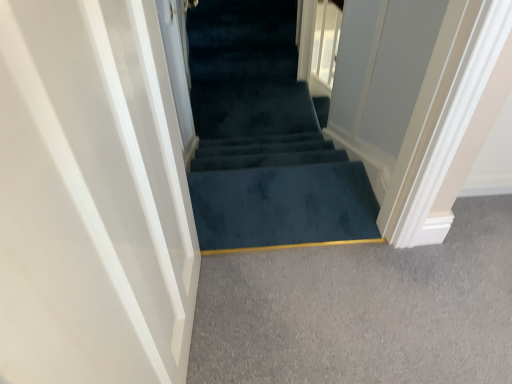
Question: Is white glossy door at left wider than teal carpeted stairs at center?

Choices:
 (A) no
 (B) yes

Answer: (B)

Question: Is white glossy door at left taller than teal carpeted stairs at center?

Choices:
 (A) no
 (B) yes

Answer: (B)

Question: Does white glossy door at left have a larger size compared to teal carpeted stairs at center?

Choices:
 (A) yes
 (B) no

Answer: (A)

Question: Does white glossy door at left come behind teal carpeted stairs at center?

Choices:
 (A) no
 (B) yes

Answer: (A)

Question: Is white glossy door at left not near teal carpeted stairs at center?

Choices:
 (A) no
 (B) yes

Answer: (B)

Question: Is white glossy door at left positioned with its back to teal carpeted stairs at center?

Choices:
 (A) no
 (B) yes

Answer: (A)

Question: From the image's perspective, would you say teal carpeted stairs at center is shown under white glossy door at left?

Choices:
 (A) yes
 (B) no

Answer: (B)

Question: Does teal carpeted stairs at center have a smaller size compared to white glossy door at left?

Choices:
 (A) no
 (B) yes

Answer: (B)

Question: Can you confirm if teal carpeted stairs at center is wider than white glossy door at left?

Choices:
 (A) yes
 (B) no

Answer: (B)

Question: From the image's perspective, is teal carpeted stairs at center on white glossy door at left?

Choices:
 (A) yes
 (B) no

Answer: (A)

Question: Considering the relative sizes of teal carpeted stairs at center and white glossy door at left in the image provided, is teal carpeted stairs at center thinner than white glossy door at left?

Choices:
 (A) no
 (B) yes

Answer: (B)

Question: Does teal carpeted stairs at center have a larger size compared to white glossy door at left?

Choices:
 (A) yes
 (B) no

Answer: (B)

Question: Visually, is teal carpeted stairs at center positioned to the left or to the right of white glossy door at left?

Choices:
 (A) left
 (B) right

Answer: (B)